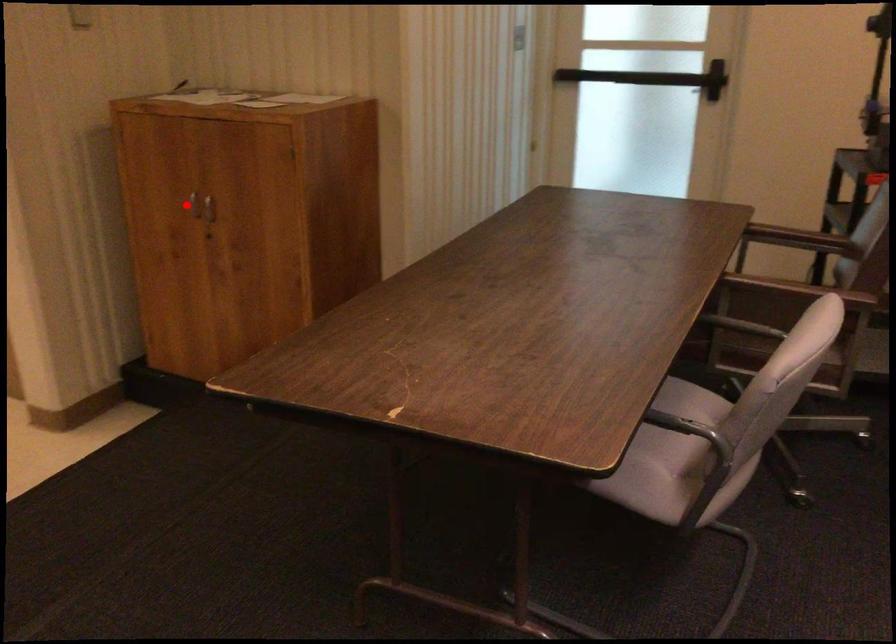
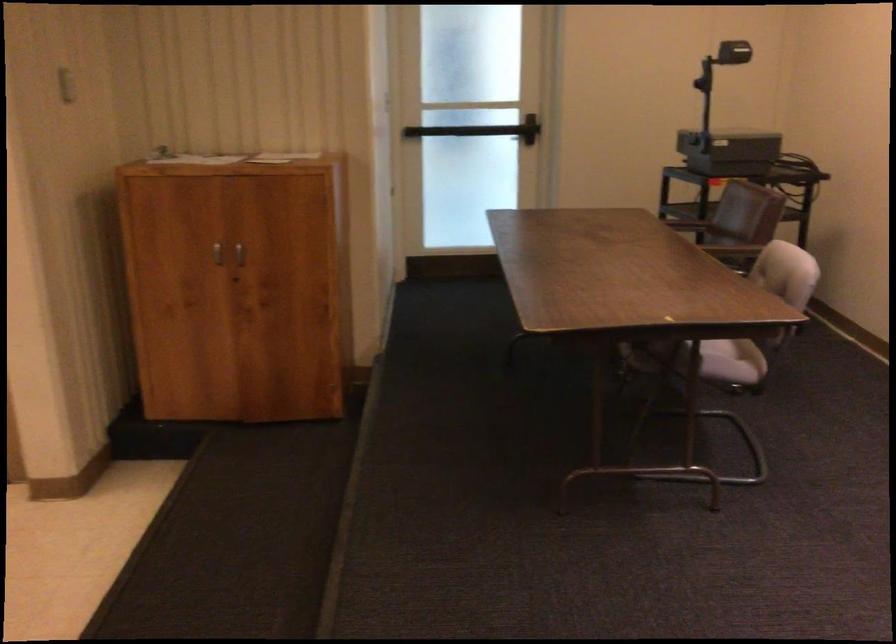
Question: A red point is marked in image1. In image2, is the corresponding 3D point closer to the camera or farther? Reply with the corresponding letter.

Choices:
 (A) The corresponding 3D point is closer.
 (B) The corresponding 3D point is farther.

Answer: (B)